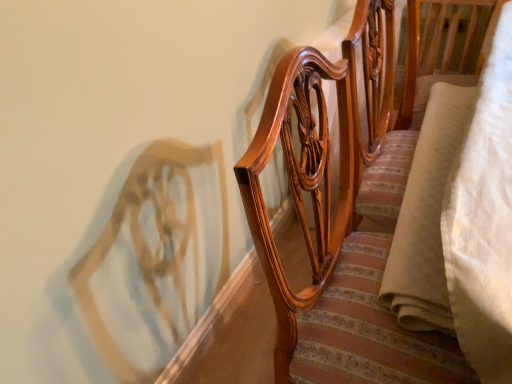
Question: Would you say glossy wood chair at upper center is to the left or to the right of beige suede blanket at right in the picture?

Choices:
 (A) right
 (B) left

Answer: (B)

Question: From the image's perspective, relative to beige suede blanket at right, is glossy wood chair at upper center above or below?

Choices:
 (A) above
 (B) below

Answer: (B)

Question: Considering the positions of glossy wood chair at upper center and beige suede blanket at right in the image, is glossy wood chair at upper center bigger or smaller than beige suede blanket at right?

Choices:
 (A) big
 (B) small

Answer: (A)

Question: Considering the relative positions of beige suede blanket at right and glossy wood chair at upper center in the image provided, is beige suede blanket at right to the left or to the right of glossy wood chair at upper center?

Choices:
 (A) right
 (B) left

Answer: (A)

Question: In terms of size, does beige suede blanket at right appear bigger or smaller than glossy wood chair at upper center?

Choices:
 (A) big
 (B) small

Answer: (B)

Question: From a real-world perspective, relative to glossy wood chair at upper center, is beige suede blanket at right vertically above or below?

Choices:
 (A) below
 (B) above

Answer: (B)

Question: Considering the positions of beige suede blanket at right and glossy wood chair at upper center in the image, is beige suede blanket at right taller or shorter than glossy wood chair at upper center?

Choices:
 (A) short
 (B) tall

Answer: (A)